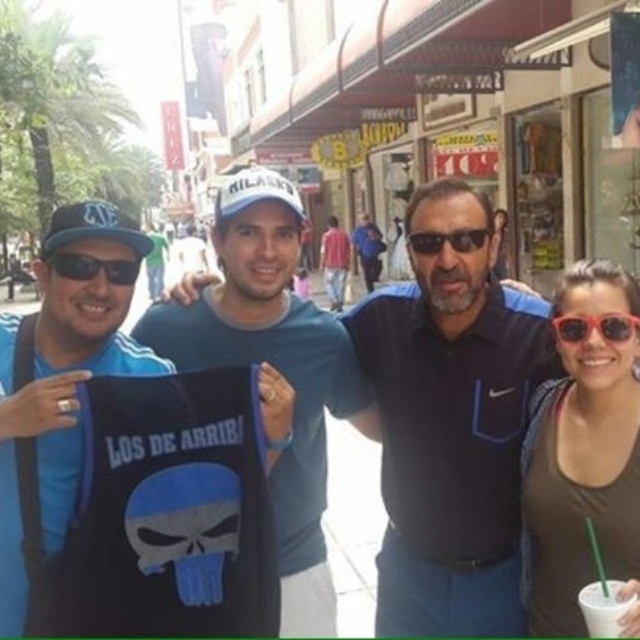
Question: Which point is closer to the camera?

Choices:
 (A) (132, 275)
 (B) (596, 616)
 (C) (202, 280)
 (D) (70, 227)

Answer: (B)

Question: Considering the relative positions of black matte t-shirt at left and white paper cup at lower right in the image provided, where is black matte t-shirt at left located with respect to white paper cup at lower right?

Choices:
 (A) left
 (B) right

Answer: (A)

Question: Which point is closer to the camera?

Choices:
 (A) (92, 273)
 (B) (461, 388)
 (C) (54, 280)
 (D) (433, 244)

Answer: (A)

Question: Among these objects, which one is farthest from the camera?

Choices:
 (A) matte black baseball cap at left
 (B) black plastic sunglasses at center
 (C) matte black t-shirt at lower right
 (D) black matte t-shirt at left

Answer: (B)

Question: Observing the image, what is the correct spatial positioning of white paper cup at lower right in reference to translucent orange sunglasses at right?

Choices:
 (A) right
 (B) left

Answer: (B)

Question: Is matte black baseball cap at left wider than translucent orange sunglasses at right?

Choices:
 (A) yes
 (B) no

Answer: (A)